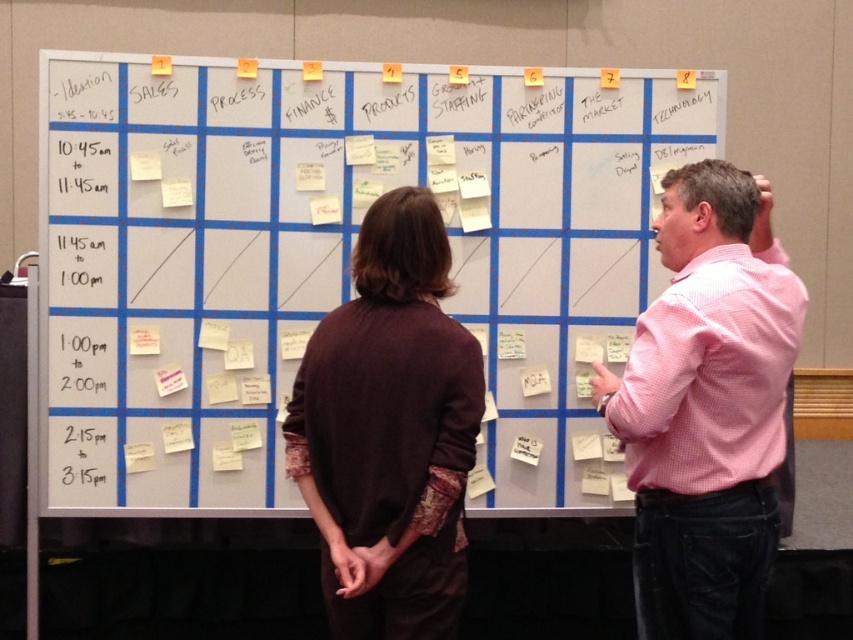
You are an observer standing in front of the white paperboard at center and the brown wool sweater at center. Which object is taller?

The white paperboard at center is taller than the brown wool sweater at center.

You are observing two people in front of a whiteboard. You notice the pink checkered shirt at upper right and the pink checkered shirt at right. Which one is wider?

The pink checkered shirt at upper right is wider than the pink checkered shirt at right.

You are observing two people near a whiteboard. You notice the pink checkered shirt at upper right and the pink checkered shirt at right. Which one is positioned lower on the whiteboard?

The pink checkered shirt at upper right is located below the pink checkered shirt at right, so the pink checkered shirt at upper right is positioned lower on the whiteboard.